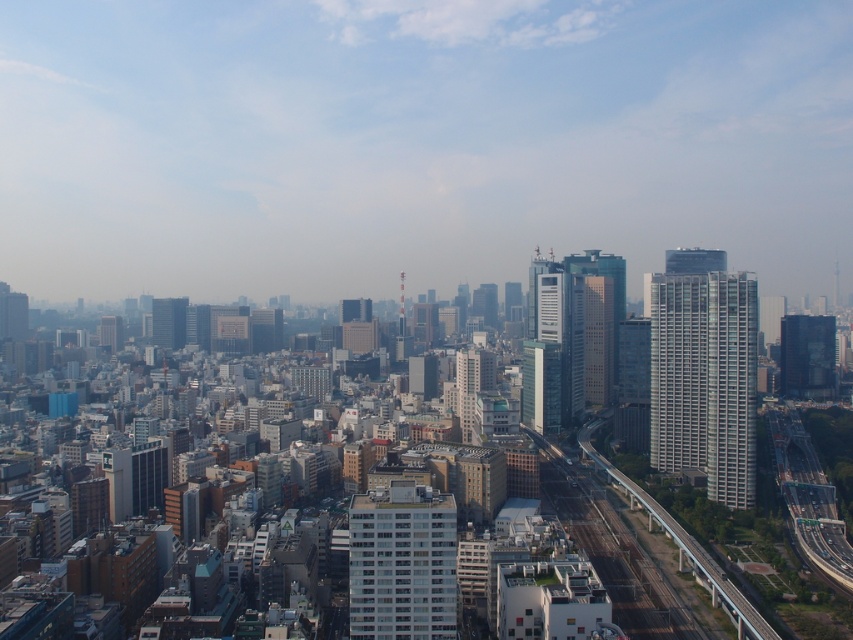
You are standing at the center of the city looking out. You see the white glass building at right and the dark glass skyscraper at right. Which one is positioned more to the left side of your view?

The white glass building at right is positioned to the left of the dark glass skyscraper at right, so the white glass building at right is more to the left side of your view.

You are standing at the observation deck of a skyscraper and notice two points marked in the cityscape. The first point is at coordinate point (654,376), and the second is at point (178,321). Which point is located closer to you?

Point (654,376) is closer to the viewer than point (178,321).